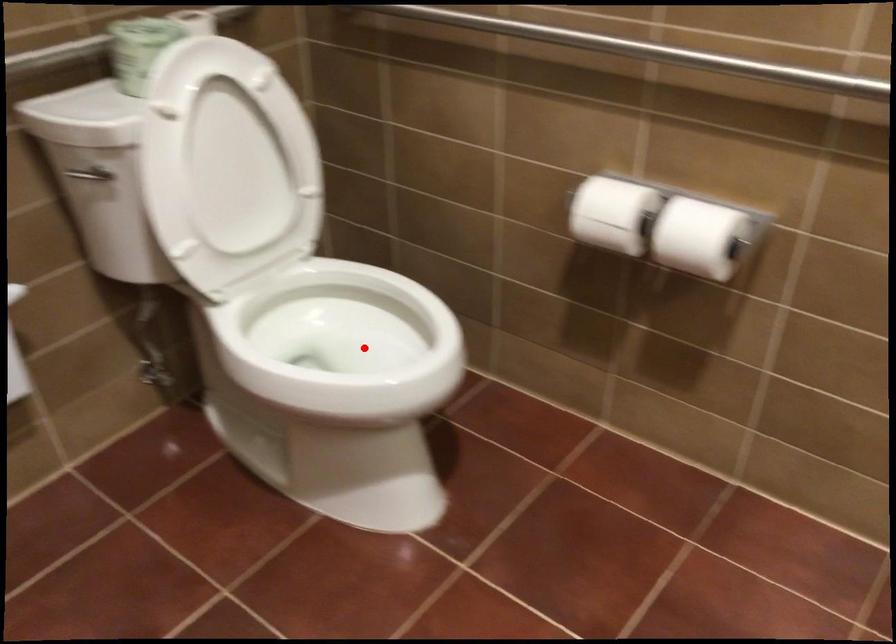
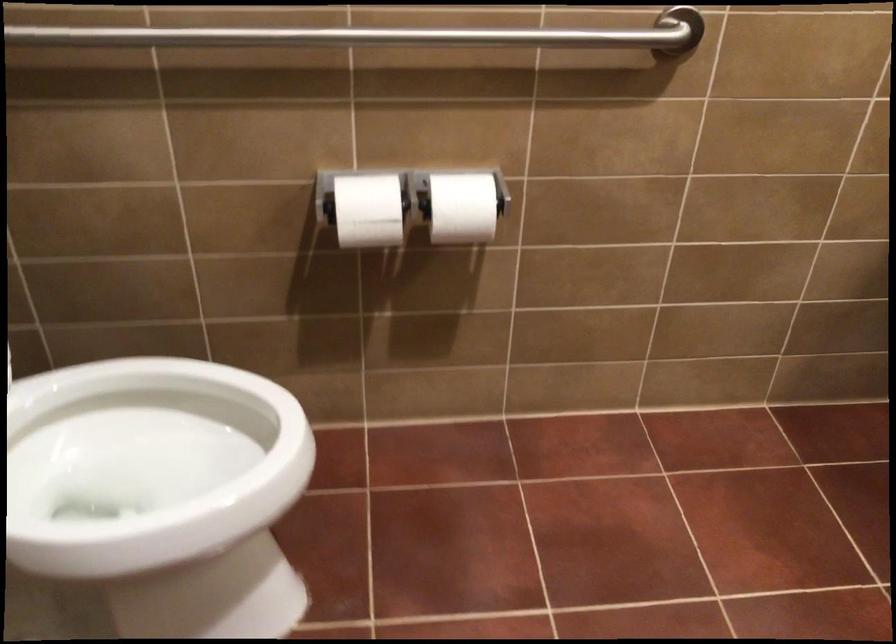
The point at the highlighted location is marked in the first image. Where is the corresponding point in the second image?

(147, 464)